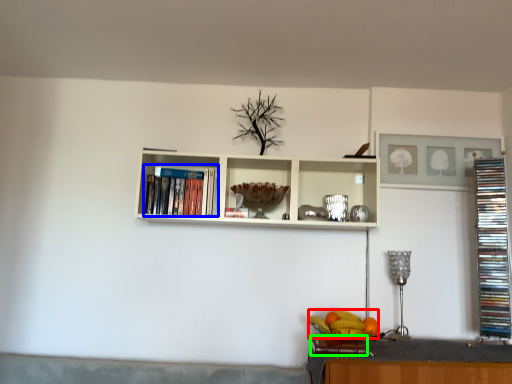
Question: Which object is positioned farthest from fruit (highlighted by a red box)? Select from book (highlighted by a blue box) and book (highlighted by a green box).

Choices:
 (A) book
 (B) book

Answer: (A)